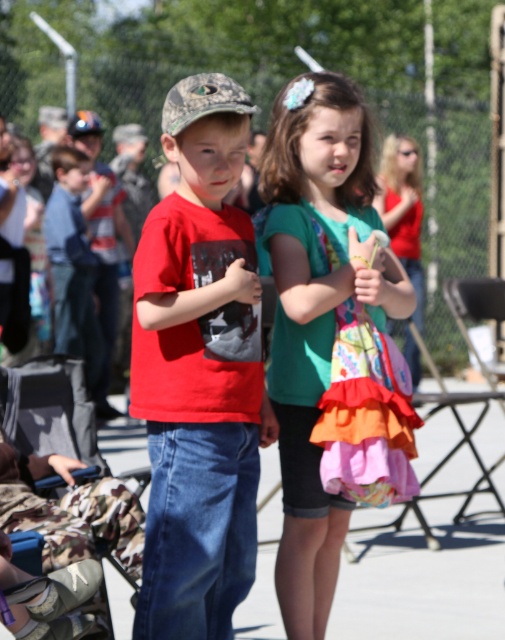
Question: Is matte red t-shirt at center to the left of teal fabric dress at center from the viewer's perspective?

Choices:
 (A) yes
 (B) no

Answer: (A)

Question: Which of the following is the farthest from the observer?

Choices:
 (A) (273, 244)
 (B) (216, 102)

Answer: (A)

Question: Which of the following is the farthest from the observer?

Choices:
 (A) (322, 561)
 (B) (224, 182)

Answer: (A)

Question: Does matte red t-shirt at center appear over teal fabric dress at center?

Choices:
 (A) yes
 (B) no

Answer: (B)

Question: From the image, what is the correct spatial relationship of matte red t-shirt at center in relation to teal fabric dress at center?

Choices:
 (A) right
 (B) left

Answer: (B)